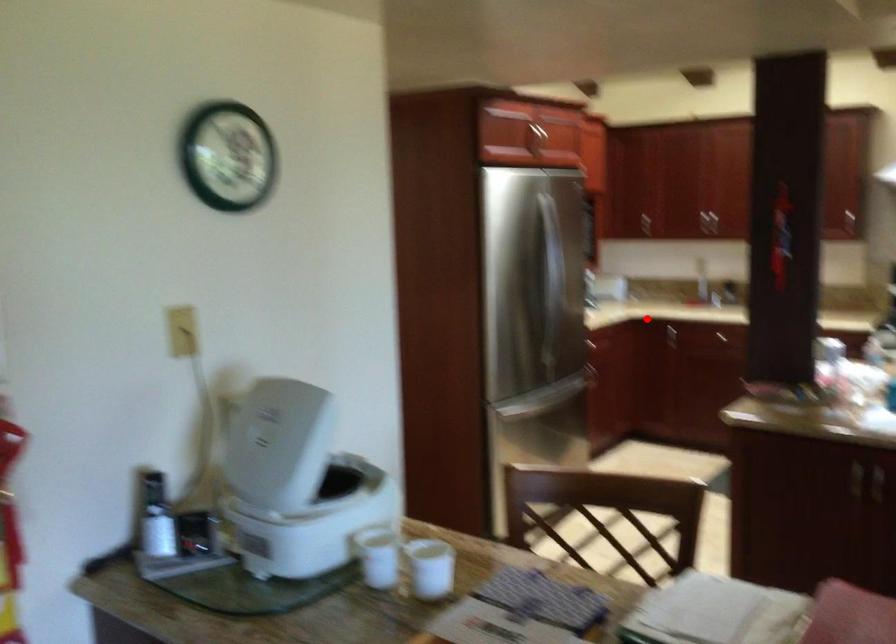
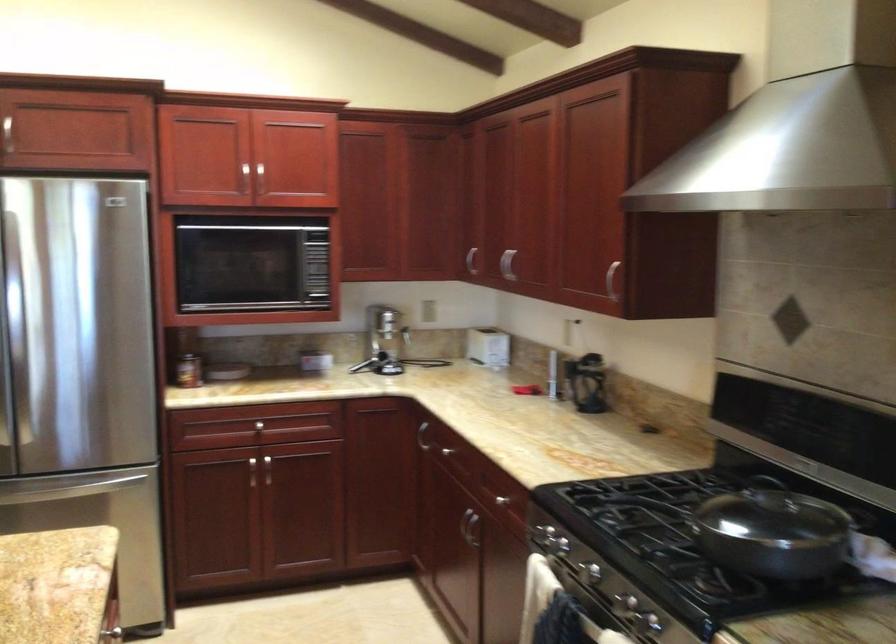
Question: I am providing you with two images of the same scene from different viewpoints. In image1, a red point is highlighted. Considering the same 3D point in image2, which of the following is correct?

Choices:
 (A) It is closer
 (B) It is farther

Answer: (A)